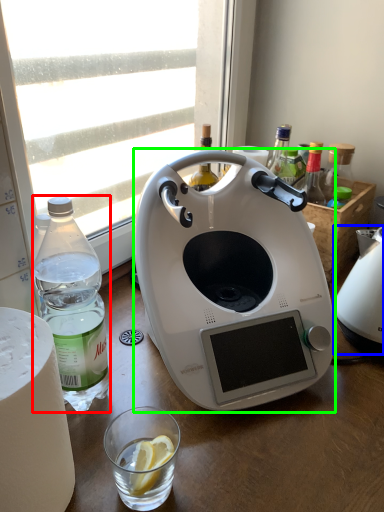
Question: Considering the real-world distances, which object is farthest from bottle (highlighted by a red box)? kitchen appliance (highlighted by a blue box) or kitchen appliance (highlighted by a green box)?

Choices:
 (A) kitchen appliance
 (B) kitchen appliance

Answer: (A)